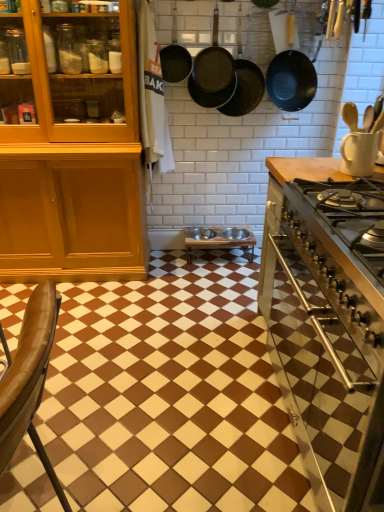
Question: Can you confirm if wooden table at center is thinner than brown glossy tile at center?

Choices:
 (A) yes
 (B) no

Answer: (A)

Question: Is wooden table at center at the left side of brown glossy tile at center?

Choices:
 (A) no
 (B) yes

Answer: (A)

Question: Is wooden table at center further to camera compared to brown glossy tile at center?

Choices:
 (A) yes
 (B) no

Answer: (A)

Question: Are wooden table at center and brown glossy tile at center far apart?

Choices:
 (A) no
 (B) yes

Answer: (A)

Question: From a real-world perspective, does wooden table at center sit lower than brown glossy tile at center?

Choices:
 (A) no
 (B) yes

Answer: (A)

Question: Is wooden table at center in front of brown glossy tile at center?

Choices:
 (A) no
 (B) yes

Answer: (A)

Question: Considering the relative sizes of white matte mug at upper right and dark brown matte frying pan at upper center, acting as the 3th frying pan starting from the left, in the image provided, is white matte mug at upper right taller than dark brown matte frying pan at upper center, acting as the 3th frying pan starting from the left,?

Choices:
 (A) yes
 (B) no

Answer: (B)

Question: Does white matte mug at upper right lie in front of dark brown matte frying pan at upper center, acting as the 3th frying pan starting from the left?

Choices:
 (A) yes
 (B) no

Answer: (A)

Question: Could you tell me if white matte mug at upper right is turned towards dark brown matte frying pan at upper center, which is the second frying pan in right-to-left order?

Choices:
 (A) no
 (B) yes

Answer: (A)

Question: Considering the relative sizes of white matte mug at upper right and dark brown matte frying pan at upper center, which is the second frying pan in right-to-left order, in the image provided, is white matte mug at upper right wider than dark brown matte frying pan at upper center, which is the second frying pan in right-to-left order,?

Choices:
 (A) yes
 (B) no

Answer: (A)

Question: Considering the relative sizes of white matte mug at upper right and dark brown matte frying pan at upper center, acting as the 3th frying pan starting from the left, in the image provided, is white matte mug at upper right thinner than dark brown matte frying pan at upper center, acting as the 3th frying pan starting from the left,?

Choices:
 (A) no
 (B) yes

Answer: (A)

Question: Is white matte mug at upper right turned away from dark brown matte frying pan at upper center, acting as the 3th frying pan starting from the left?

Choices:
 (A) no
 (B) yes

Answer: (A)

Question: From a real-world perspective, is black matte frying pan at upper center, positioned as the 4th frying pan in left-to-right order, over black cast iron frying pan at upper center, which appears as the 3th frying pan when viewed from the right?

Choices:
 (A) yes
 (B) no

Answer: (B)